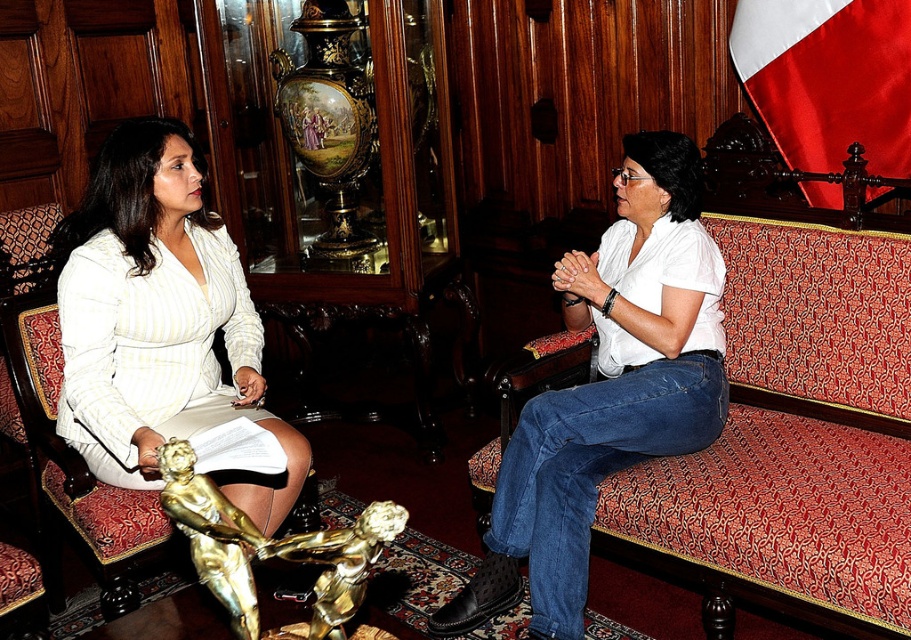
Question: From the image, what is the correct spatial relationship of white striped fabric skirt at left in relation to gold metallic statue at lower left?

Choices:
 (A) left
 (B) right

Answer: (A)

Question: Can you confirm if red velvet couch at right is smaller than gold metallic statue at lower center?

Choices:
 (A) yes
 (B) no

Answer: (B)

Question: Which of the following is the farthest from the observer?

Choices:
 (A) white striped fabric skirt at left
 (B) red velvet couch at right
 (C) gold metallic statue at lower left
 (D) white cotton shirt at center

Answer: (A)

Question: Which point is farther to the camera?

Choices:
 (A) gold metallic statue at lower left
 (B) gold metallic statue at lower center
 (C) red velvet couch at right
 (D) white satin flag at upper right

Answer: (D)

Question: Does white cotton shirt at center have a smaller size compared to gold metallic statue at lower left?

Choices:
 (A) yes
 (B) no

Answer: (B)

Question: Which of the following is the farthest from the observer?

Choices:
 (A) (315, 532)
 (B) (804, 138)

Answer: (B)